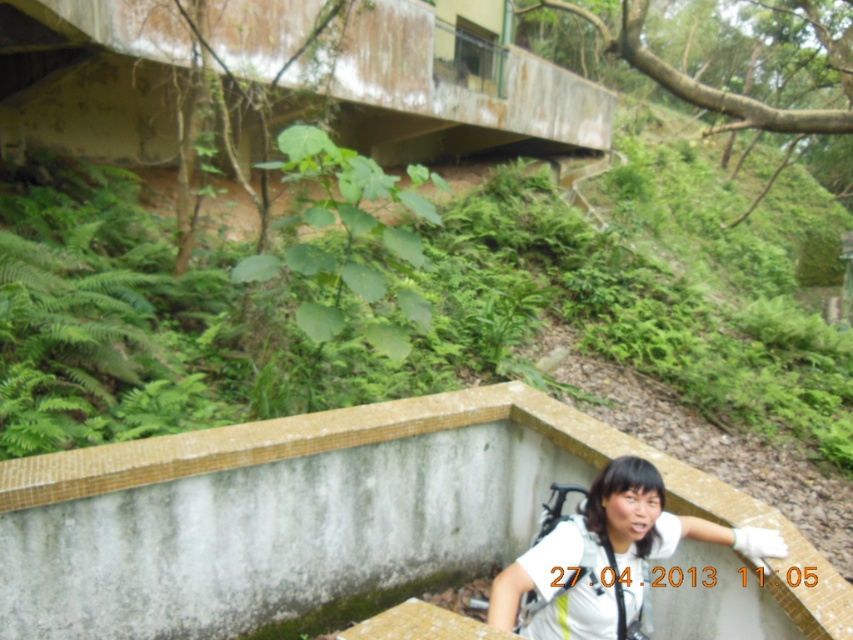
Is the position of white mosaic ledge at lower center less distant than that of white matte shirt at lower center?

That is False.

Can you confirm if white mosaic ledge at lower center is thinner than white matte shirt at lower center?

No.

Between point (479, 509) and point (628, 461), which one is positioned in front?

Point (628, 461) is in front.

Where is `white mosaic ledge at lower center`? white mosaic ledge at lower center is located at coordinates (352, 522).